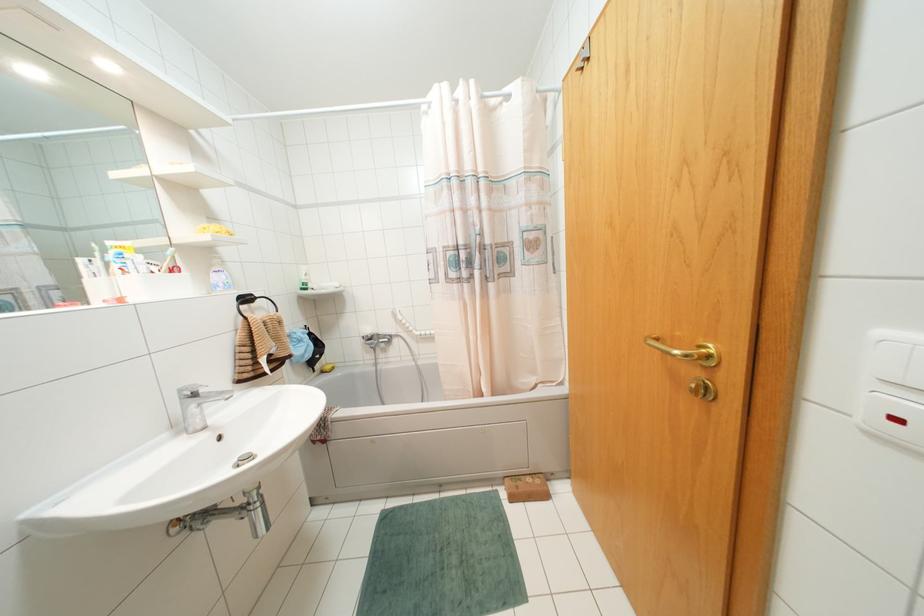
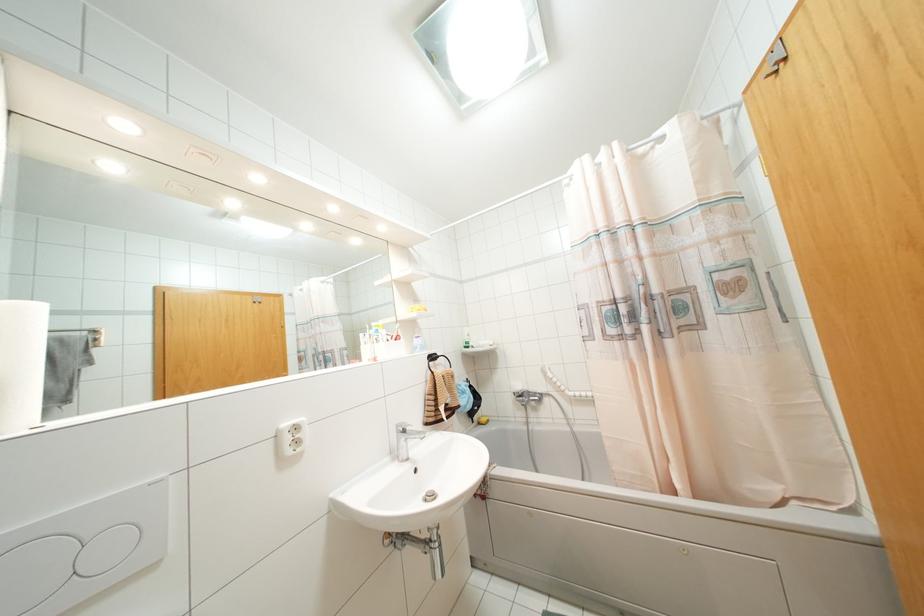
In the second image, find the point that corresponds to (588,58) in the first image.

(784, 58)